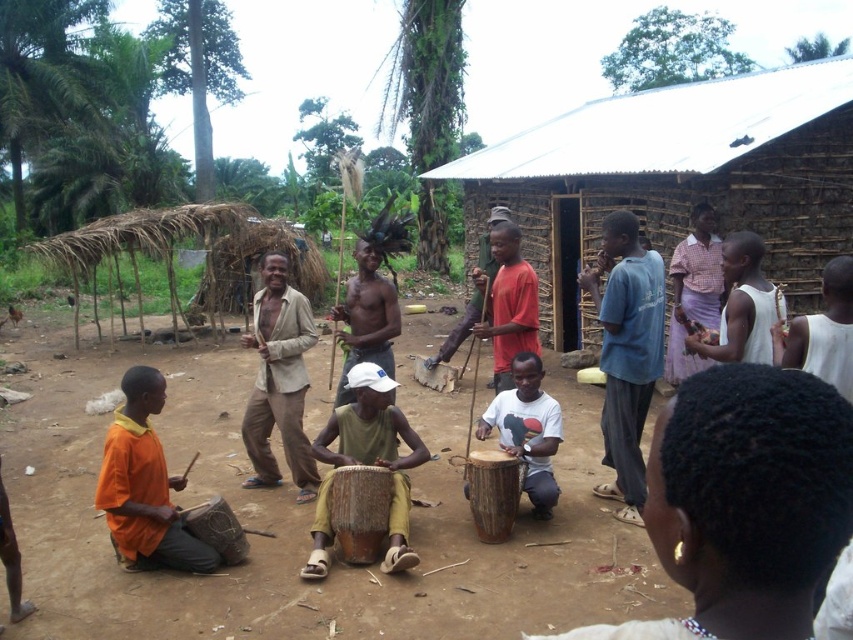
Is point (175, 476) behind point (263, 380)?

No, it is in front of (263, 380).

Is orange fabric drum at lower left to the right of beige fabric shirt at center from the viewer's perspective?

In fact, orange fabric drum at lower left is to the left of beige fabric shirt at center.

Is point (131, 452) less distant than point (299, 326)?

Yes, it is in front of point (299, 326).

The width and height of the screenshot is (853, 640). What are the coordinates of `orange fabric drum at lower left` in the screenshot? It's located at (144, 484).

Who is higher up, shiny skin at center or brown wooden drum at center?

Positioned higher is shiny skin at center.

Does shiny skin at center appear on the right side of brown wooden drum at center?

Incorrect, shiny skin at center is not on the right side of brown wooden drum at center.

The image size is (853, 640). Identify the location of shiny skin at center. (366, 317).

The height and width of the screenshot is (640, 853). Identify the location of shiny skin at center. 366,317.

Does matte red shirt at center have a lesser height compared to brown wooden drum at lower left?

Incorrect, matte red shirt at center's height does not fall short of brown wooden drum at lower left's.

Which is in front, point (496, 312) or point (228, 557)?

Point (228, 557) is more forward.

Between point (511, 252) and point (209, 499), which one is positioned in front?

Point (511, 252)

I want to click on matte red shirt at center, so click(509, 305).